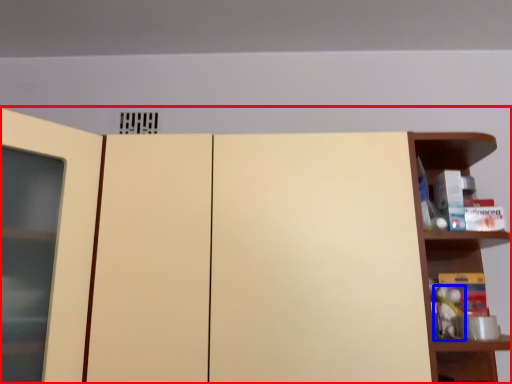
Question: Among these objects, which one is farthest to the camera, cupboard (highlighted by a red box) or toy (highlighted by a blue box)?

Choices:
 (A) cupboard
 (B) toy

Answer: (B)